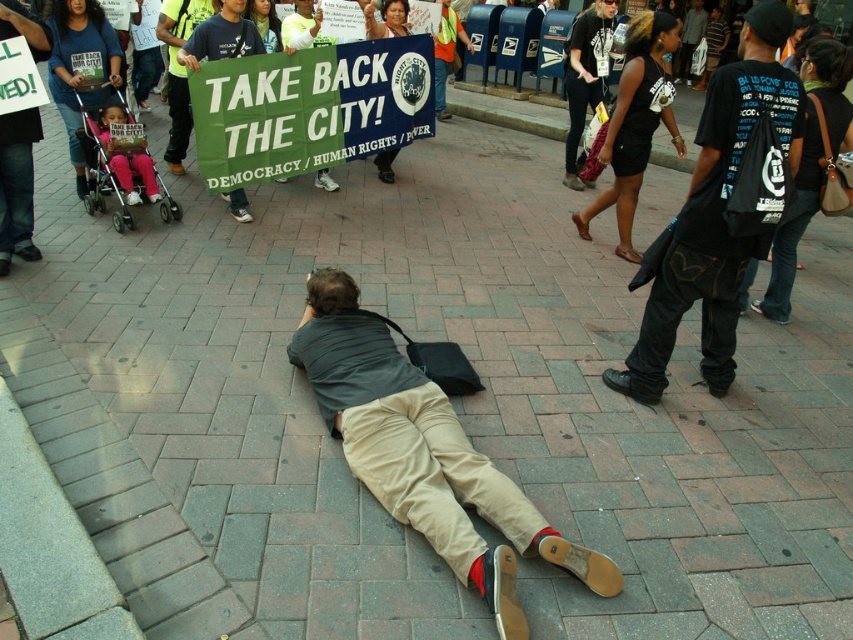
Which is more to the right, khaki cotton pants at center or black cotton t-shirt at center?

From the viewer's perspective, black cotton t-shirt at center appears more on the right side.

This screenshot has width=853, height=640. What do you see at coordinates (424, 452) in the screenshot?
I see `khaki cotton pants at center` at bounding box center [424, 452].

Image resolution: width=853 pixels, height=640 pixels. Find the location of `khaki cotton pants at center`. khaki cotton pants at center is located at coordinates (424, 452).